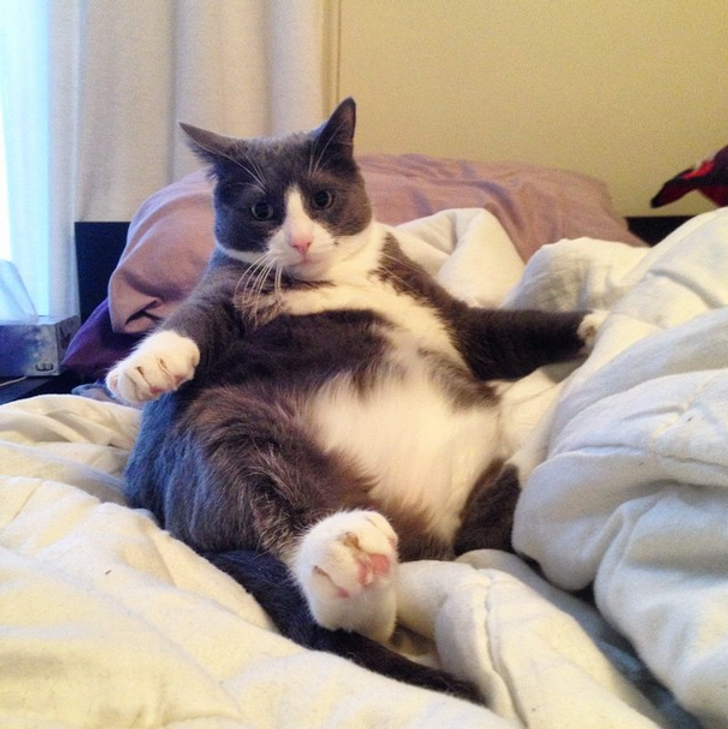
Where is `curtain`? The image size is (728, 729). curtain is located at coordinates (68, 154).